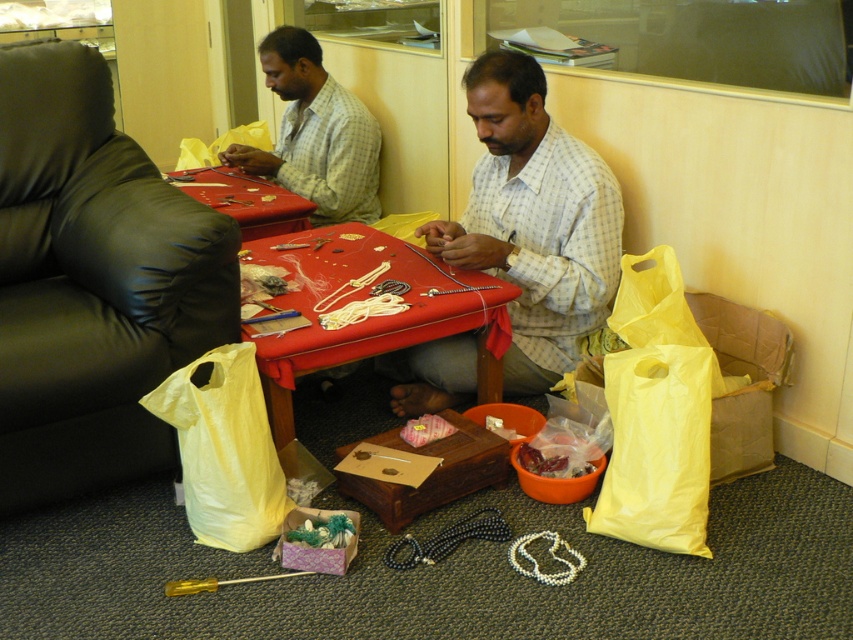
Locate an element on the screen. Image resolution: width=853 pixels, height=640 pixels. black leather armchair at left is located at coordinates (91, 282).

Between black leather armchair at left and red leather table at center, which one has more height?

black leather armchair at left

Does point (44, 161) lie in front of point (253, 224)?

Yes.

The height and width of the screenshot is (640, 853). In order to click on black leather armchair at left in this screenshot , I will do `click(91, 282)`.

Is white checkered shirt at center taller than red leather table at center?

Correct, white checkered shirt at center is much taller as red leather table at center.

The height and width of the screenshot is (640, 853). Identify the location of white checkered shirt at center. (534, 220).

Can you confirm if black leather armchair at left is taller than yellow plastic bag at lower left?

Correct, black leather armchair at left is much taller as yellow plastic bag at lower left.

Is the position of black leather armchair at left less distant than that of yellow plastic bag at lower left?

That is True.

Locate an element on the screen. black leather armchair at left is located at coordinates (91, 282).